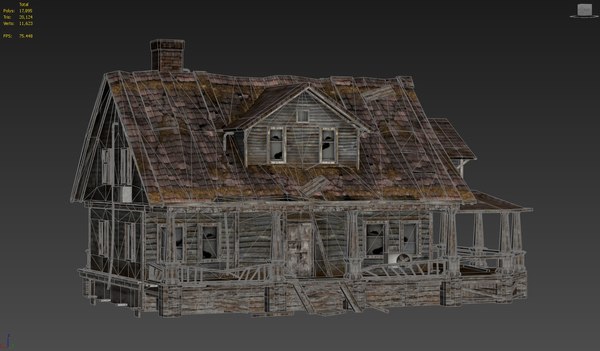
Identify the location of chimney. (158, 45), (179, 47), (158, 67), (177, 65).